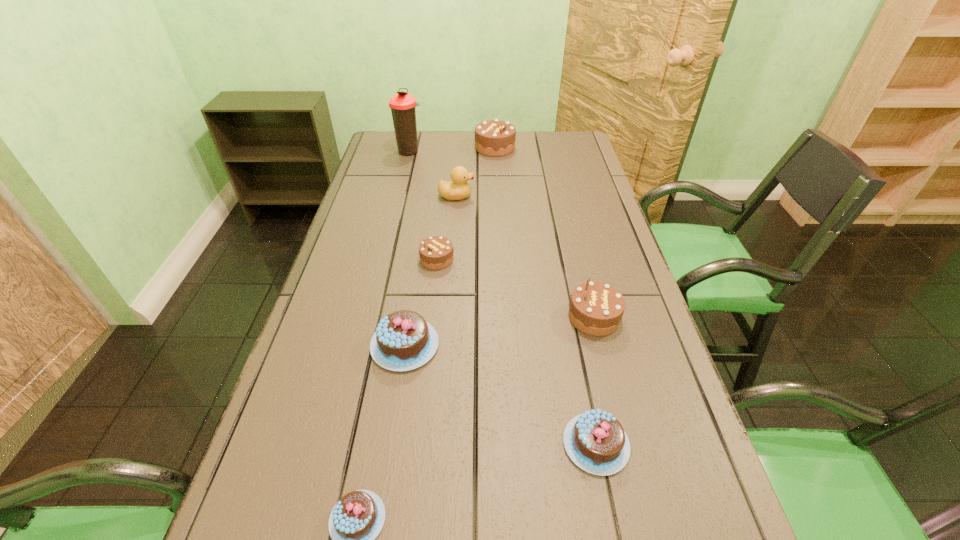
Find the location of a particular element. the second biggest pink chocolate cake is located at coordinates (595, 441).

The width and height of the screenshot is (960, 540). I want to click on the seventh farthest object, so click(x=595, y=441).

Image resolution: width=960 pixels, height=540 pixels. What are the coordinates of `vacant position located on the right of the thermos bottle` in the screenshot? It's located at (494, 152).

The height and width of the screenshot is (540, 960). I want to click on vacant space situated 0.080m on the front of the second brown chocolate cake from right to left, so click(x=496, y=168).

The width and height of the screenshot is (960, 540). Find the location of `free location located facing forward on the third farthest object`. free location located facing forward on the third farthest object is located at coordinates (496, 196).

Find the location of a particular element. free region located 0.100m on the front of the rightmost brown chocolate cake is located at coordinates (609, 375).

Where is `vacant space situated 0.050m on the front of the farthest pink chocolate cake`? vacant space situated 0.050m on the front of the farthest pink chocolate cake is located at coordinates (397, 395).

Identify the location of vacant area situated on the left of the fifth nearest object. Image resolution: width=960 pixels, height=540 pixels. click(x=357, y=259).

Locate an element on the screen. free space located on the left of the rightmost pink chocolate cake is located at coordinates (486, 444).

You are a GUI agent. You are given a task and a screenshot of the screen. Output one action in this format:
    pyautogui.click(x=<x>, y=<y>)
    Task: Click on the thermos bottle that is positioned at the far edge
    The height and width of the screenshot is (540, 960).
    Given the screenshot: What is the action you would take?
    pyautogui.click(x=402, y=105)